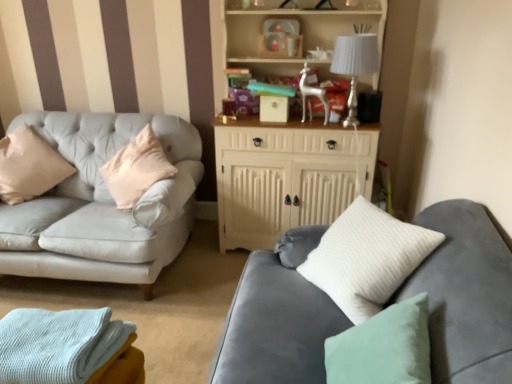
Question: Are white fabric lampshade at upper right and light blue knitted blanket at lower left far apart?

Choices:
 (A) yes
 (B) no

Answer: (A)

Question: From the image's perspective, is white fabric lampshade at upper right below light blue knitted blanket at lower left?

Choices:
 (A) yes
 (B) no

Answer: (B)

Question: Is white fabric lampshade at upper right not within light blue knitted blanket at lower left?

Choices:
 (A) yes
 (B) no

Answer: (A)

Question: Is the depth of white fabric lampshade at upper right greater than that of light blue knitted blanket at lower left?

Choices:
 (A) yes
 (B) no

Answer: (A)

Question: Does white fabric lampshade at upper right have a lesser width compared to light blue knitted blanket at lower left?

Choices:
 (A) yes
 (B) no

Answer: (A)

Question: Considering the relative positions of white fabric lampshade at upper right and light blue knitted blanket at lower left in the image provided, is white fabric lampshade at upper right in front of light blue knitted blanket at lower left?

Choices:
 (A) yes
 (B) no

Answer: (B)

Question: Can you confirm if light blue knitted blanket at lower left is positioned to the left of white wood cabinet at upper center?

Choices:
 (A) no
 (B) yes

Answer: (B)

Question: From a real-world perspective, is light blue knitted blanket at lower left on white wood cabinet at upper center?

Choices:
 (A) yes
 (B) no

Answer: (B)

Question: Can you confirm if light blue knitted blanket at lower left is shorter than white wood cabinet at upper center?

Choices:
 (A) yes
 (B) no

Answer: (A)

Question: Is light blue knitted blanket at lower left positioned before white wood cabinet at upper center?

Choices:
 (A) no
 (B) yes

Answer: (B)

Question: From the image's perspective, does light blue knitted blanket at lower left appear higher than white wood cabinet at upper center?

Choices:
 (A) yes
 (B) no

Answer: (B)

Question: Is the position of light blue knitted blanket at lower left more distant than that of white wood cabinet at upper center?

Choices:
 (A) no
 (B) yes

Answer: (A)

Question: Is velvet gray couch at lower right thinner than white wood cabinet at upper center?

Choices:
 (A) yes
 (B) no

Answer: (A)